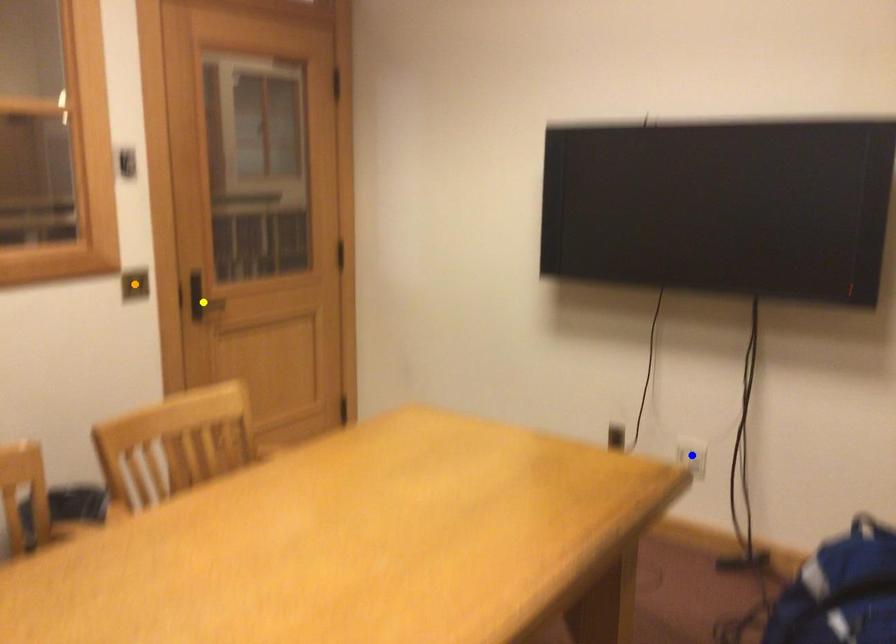
Order these from farthest to nearest:
blue point | yellow point | orange point

1. yellow point
2. blue point
3. orange point